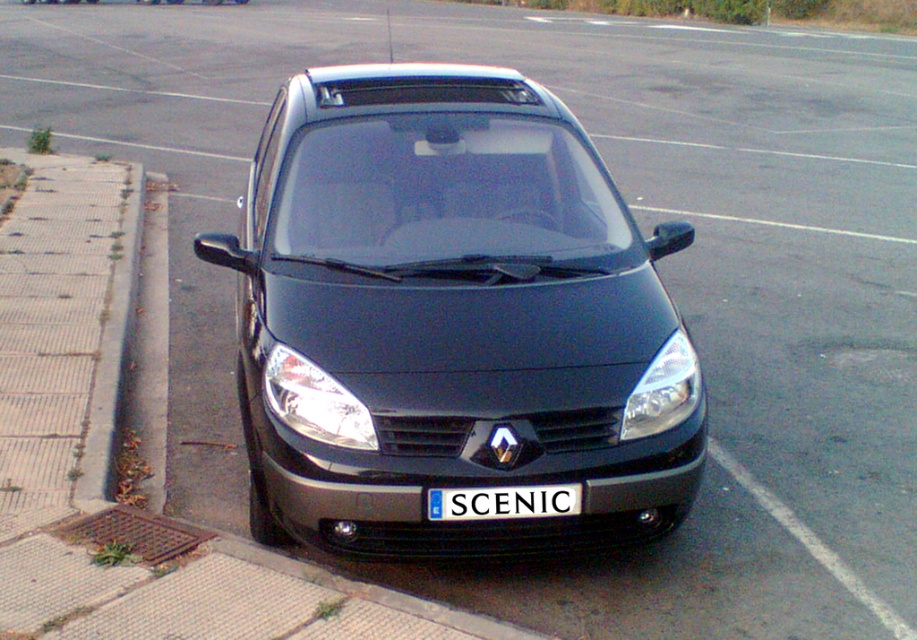
Question: Can you confirm if matte black car at center is positioned to the right of white plastic license plate at center?

Choices:
 (A) yes
 (B) no

Answer: (B)

Question: Which object appears closest to the camera in this image?

Choices:
 (A) matte black car at center
 (B) white plastic license plate at center

Answer: (B)

Question: Can you confirm if matte black car at center is positioned to the left of white plastic license plate at center?

Choices:
 (A) no
 (B) yes

Answer: (B)

Question: Which of the following is the farthest from the observer?

Choices:
 (A) (481, 113)
 (B) (561, 508)

Answer: (A)

Question: Does matte black car at center have a larger size compared to white plastic license plate at center?

Choices:
 (A) yes
 (B) no

Answer: (A)

Question: Which of the following is the closest to the observer?

Choices:
 (A) (498, 83)
 (B) (578, 492)

Answer: (B)